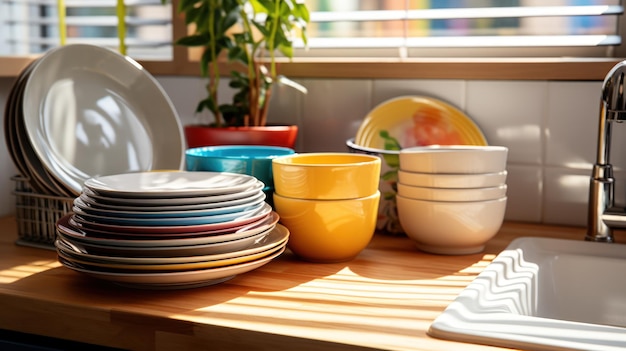
Where is `edges of white stacked bowls`? The image size is (626, 351). edges of white stacked bowls is located at coordinates (431, 217), (453, 195), (467, 182), (475, 162).